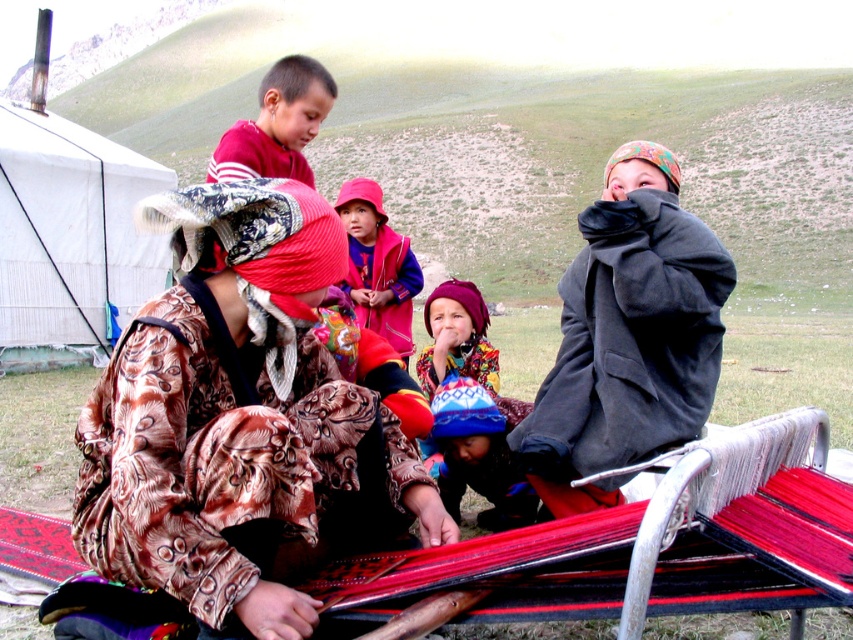
Question: Estimate the real-world distances between objects in this image. Which object is farther from the multicolored knitted hat at center?

Choices:
 (A) red cotton shirt at center
 (B) brown velvety robe at center

Answer: (A)

Question: Does dark gray fleece robe at right appear on the left side of red fleece vest at center?

Choices:
 (A) no
 (B) yes

Answer: (A)

Question: Which point appears closest to the camera in this image?

Choices:
 (A) (445, 330)
 (B) (503, 470)

Answer: (B)

Question: Does brown velvety robe at center have a smaller size compared to red velvet robe at upper center?

Choices:
 (A) no
 (B) yes

Answer: (B)

Question: Considering the real-world distances, which object is closest to the dark gray fleece robe at right?

Choices:
 (A) red velvet robe at upper center
 (B) multicolored knitted hat at center
 (C) brown velvety robe at center
 (D) red cotton shirt at center

Answer: (B)

Question: Is blue knitted hat at lower center bigger than red fleece vest at center?

Choices:
 (A) yes
 (B) no

Answer: (B)